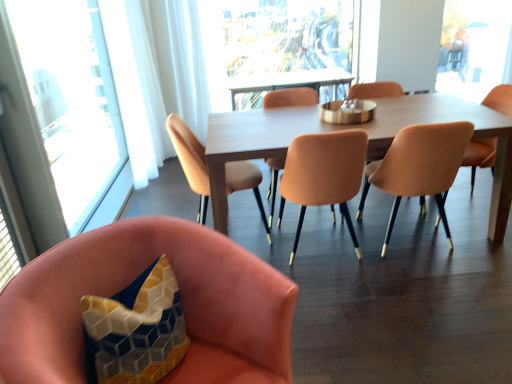
Question: From the image's perspective, is transparent glass window at left, positioned as the 1th window in front-to-back order, on matte orange chair at center, which appears as the second chair when viewed from the right?

Choices:
 (A) yes
 (B) no

Answer: (A)

Question: Considering the relative positions of transparent glass window at left, the first window from the left, and matte orange chair at center, which appears as the second chair when viewed from the right, in the image provided, is transparent glass window at left, the first window from the left, to the left of matte orange chair at center, which appears as the second chair when viewed from the right, from the viewer's perspective?

Choices:
 (A) yes
 (B) no

Answer: (A)

Question: From the image's perspective, is transparent glass window at left, positioned as the 2th window in right-to-left order, under matte orange chair at center, which appears as the second chair when viewed from the right?

Choices:
 (A) no
 (B) yes

Answer: (A)

Question: Can you confirm if transparent glass window at left, the first window from the left, is smaller than matte orange chair at center, which appears as the second chair when viewed from the right?

Choices:
 (A) no
 (B) yes

Answer: (A)

Question: Is transparent glass window at left, the first window from the left, not near matte orange chair at center, which is counted as the fifth chair, starting from the left?

Choices:
 (A) no
 (B) yes

Answer: (B)

Question: Is transparent glass window at left, positioned as the 1th window in front-to-back order, oriented away from matte orange chair at center, which appears as the second chair when viewed from the right?

Choices:
 (A) yes
 (B) no

Answer: (B)

Question: Would you say velvet pink chair at lower left, positioned as the 1th chair in left-to-right order, contains matte peach chair at center, the 5th chair when ordered from right to left?

Choices:
 (A) yes
 (B) no

Answer: (B)

Question: Is velvet pink chair at lower left, the 6th chair in the right-to-left sequence, taller than matte peach chair at center, marked as the second chair in a left-to-right arrangement?

Choices:
 (A) no
 (B) yes

Answer: (A)

Question: Can you confirm if velvet pink chair at lower left, the 6th chair in the right-to-left sequence, is positioned to the left of matte peach chair at center, marked as the second chair in a left-to-right arrangement?

Choices:
 (A) yes
 (B) no

Answer: (A)

Question: From a real-world perspective, is velvet pink chair at lower left, positioned as the 1th chair in left-to-right order, on matte peach chair at center, marked as the second chair in a left-to-right arrangement?

Choices:
 (A) yes
 (B) no

Answer: (B)

Question: Is velvet pink chair at lower left, positioned as the 1th chair in left-to-right order, to the right of matte peach chair at center, the 5th chair when ordered from right to left, from the viewer's perspective?

Choices:
 (A) no
 (B) yes

Answer: (A)

Question: Is velvet pink chair at lower left, positioned as the 1th chair in left-to-right order, outside of matte peach chair at center, marked as the second chair in a left-to-right arrangement?

Choices:
 (A) no
 (B) yes

Answer: (B)

Question: Is matte orange chair at center, which is counted as the 3th chair, starting from the left, oriented away from matte peach armchair at center?

Choices:
 (A) yes
 (B) no

Answer: (B)